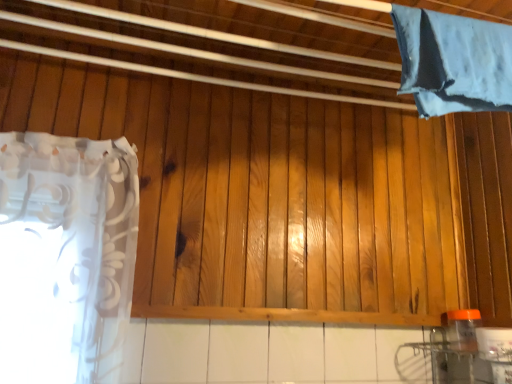
Question: Does blue fabric at upper right, acting as the second curtain starting from the bottom, appear on the left side of orange translucent bottle at lower right?

Choices:
 (A) yes
 (B) no

Answer: (A)

Question: Would you say orange translucent bottle at lower right is part of blue fabric at upper right, the 1th curtain from the top,'s contents?

Choices:
 (A) no
 (B) yes

Answer: (A)

Question: From a real-world perspective, is blue fabric at upper right, the 1th curtain from the top, under orange translucent bottle at lower right?

Choices:
 (A) no
 (B) yes

Answer: (A)

Question: From the image's perspective, does blue fabric at upper right, the 1th curtain from the top, appear higher than orange translucent bottle at lower right?

Choices:
 (A) yes
 (B) no

Answer: (A)

Question: Does blue fabric at upper right, the 1th curtain from the top, touch orange translucent bottle at lower right?

Choices:
 (A) no
 (B) yes

Answer: (A)

Question: In terms of width, does white sheer curtain at left, arranged as the 1th curtain when viewed from the left, look wider or thinner when compared to orange translucent bottle at lower right?

Choices:
 (A) thin
 (B) wide

Answer: (B)

Question: From the image's perspective, is white sheer curtain at left, acting as the second curtain starting from the right, positioned above or below orange translucent bottle at lower right?

Choices:
 (A) above
 (B) below

Answer: (A)

Question: Is point (41, 254) positioned closer to the camera than point (463, 311)?

Choices:
 (A) closer
 (B) farther

Answer: (A)

Question: Is white sheer curtain at left, the second curtain from the top, inside or outside of orange translucent bottle at lower right?

Choices:
 (A) inside
 (B) outside

Answer: (B)

Question: Based on their sizes in the image, would you say white sheer curtain at left, the second curtain from the top, is bigger or smaller than blue fabric at upper right, acting as the second curtain starting from the bottom?

Choices:
 (A) big
 (B) small

Answer: (A)

Question: Considering the relative positions of white sheer curtain at left, acting as the second curtain starting from the right, and blue fabric at upper right, acting as the second curtain starting from the bottom, in the image provided, is white sheer curtain at left, acting as the second curtain starting from the right, to the left or to the right of blue fabric at upper right, acting as the second curtain starting from the bottom,?

Choices:
 (A) right
 (B) left

Answer: (B)

Question: From a real-world perspective, is white sheer curtain at left, the second curtain from the top, physically located above or below blue fabric at upper right, acting as the second curtain starting from the bottom?

Choices:
 (A) below
 (B) above

Answer: (A)

Question: Is point (12, 175) positioned closer to the camera than point (414, 21)?

Choices:
 (A) closer
 (B) farther

Answer: (B)

Question: From a real-world perspective, relative to white sheer curtain at left, the second curtain from the top, is orange translucent bottle at lower right vertically above or below?

Choices:
 (A) below
 (B) above

Answer: (A)

Question: From their relative heights in the image, would you say orange translucent bottle at lower right is taller or shorter than white sheer curtain at left, arranged as the 1th curtain when viewed from the left?

Choices:
 (A) tall
 (B) short

Answer: (B)